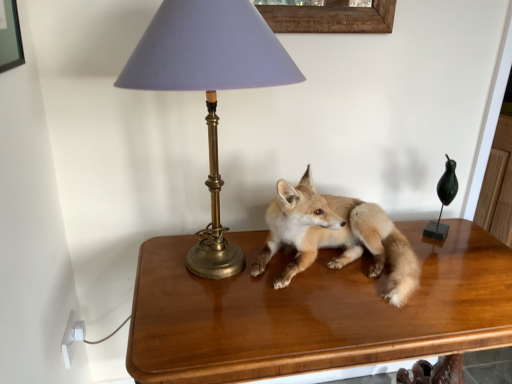
Question: Considering the relative sizes of shiny brown table at center and light brown fur fox at center in the image provided, is shiny brown table at center bigger than light brown fur fox at center?

Choices:
 (A) yes
 (B) no

Answer: (A)

Question: Is light brown fur fox at center surrounded by shiny brown table at center?

Choices:
 (A) no
 (B) yes

Answer: (A)

Question: Does shiny brown table at center turn towards light brown fur fox at center?

Choices:
 (A) yes
 (B) no

Answer: (B)

Question: Can you confirm if shiny brown table at center is taller than light brown fur fox at center?

Choices:
 (A) yes
 (B) no

Answer: (A)

Question: From a real-world perspective, is shiny brown table at center located beneath light brown fur fox at center?

Choices:
 (A) yes
 (B) no

Answer: (A)

Question: Would you say matte gold lamp at upper left is to the left or to the right of light brown fur fox at center in the picture?

Choices:
 (A) left
 (B) right

Answer: (A)

Question: Based on their sizes in the image, would you say matte gold lamp at upper left is bigger or smaller than light brown fur fox at center?

Choices:
 (A) big
 (B) small

Answer: (A)

Question: In terms of height, does matte gold lamp at upper left look taller or shorter compared to light brown fur fox at center?

Choices:
 (A) tall
 (B) short

Answer: (A)

Question: From the image's perspective, relative to light brown fur fox at center, is matte gold lamp at upper left above or below?

Choices:
 (A) above
 (B) below

Answer: (A)

Question: Based on their positions, is light brown fur fox at center located to the left or right of shiny brown table at center?

Choices:
 (A) right
 (B) left

Answer: (A)

Question: Considering the positions of light brown fur fox at center and shiny brown table at center in the image, is light brown fur fox at center taller or shorter than shiny brown table at center?

Choices:
 (A) short
 (B) tall

Answer: (A)

Question: From a real-world perspective, is light brown fur fox at center positioned above or below shiny brown table at center?

Choices:
 (A) above
 (B) below

Answer: (A)

Question: Does point (280, 223) appear closer or farther from the camera than point (210, 327)?

Choices:
 (A) closer
 (B) farther

Answer: (B)

Question: From a real-world perspective, is shiny brown table at center physically located above or below matte gold lamp at upper left?

Choices:
 (A) above
 (B) below

Answer: (B)

Question: Is shiny brown table at center in front of or behind matte gold lamp at upper left in the image?

Choices:
 (A) front
 (B) behind

Answer: (B)